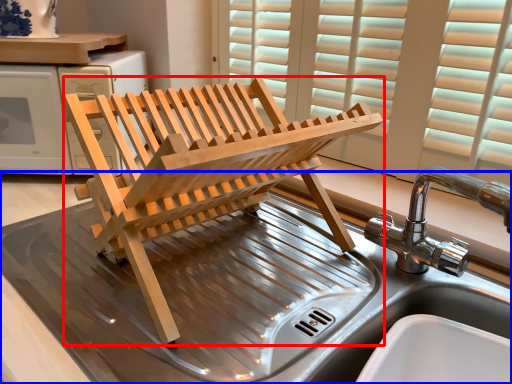
Question: Which object is closer to the camera taking this photo, furniture (highlighted by a red box) or table (highlighted by a blue box)?

Choices:
 (A) furniture
 (B) table

Answer: (B)